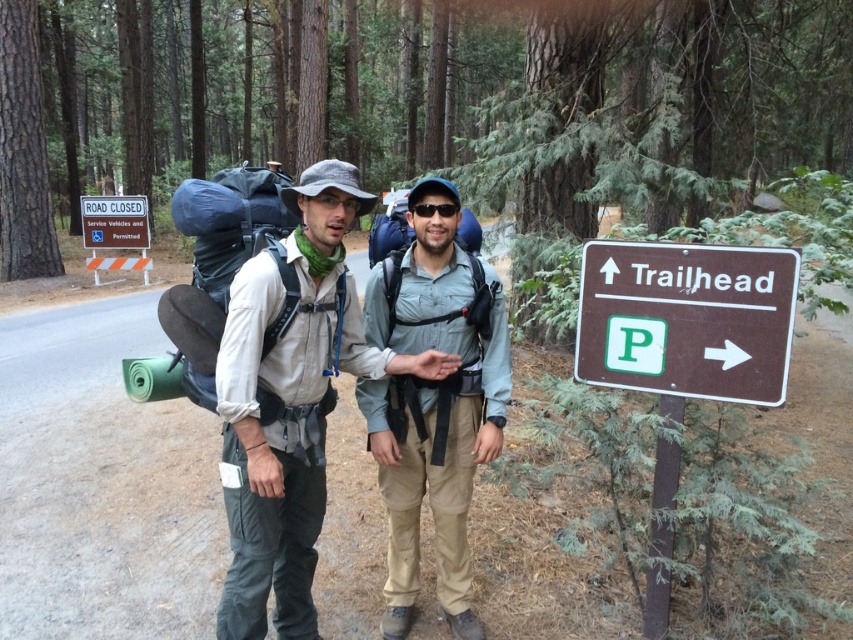
Question: Observing the image, what is the correct spatial positioning of green textured pine trees at upper left in reference to matte blue backpack at center?

Choices:
 (A) left
 (B) right

Answer: (A)

Question: Which of the following is the closest to the observer?

Choices:
 (A) (141, 204)
 (B) (473, 289)

Answer: (B)

Question: Where is matte khaki pants at center located in relation to matte blue backpack at center in the image?

Choices:
 (A) below
 (B) above

Answer: (A)

Question: Can you confirm if brown wooden sign at right is positioned below white plastic sign at left?

Choices:
 (A) no
 (B) yes

Answer: (B)

Question: Which point is farther from the camera taking this photo?

Choices:
 (A) (432, 272)
 (B) (250, 508)
 (C) (590, 266)

Answer: (A)

Question: Which object is positioned closest to the brown wooden sign at right?

Choices:
 (A) green textured pine trees at upper left
 (B) matte khaki pants at center

Answer: (B)